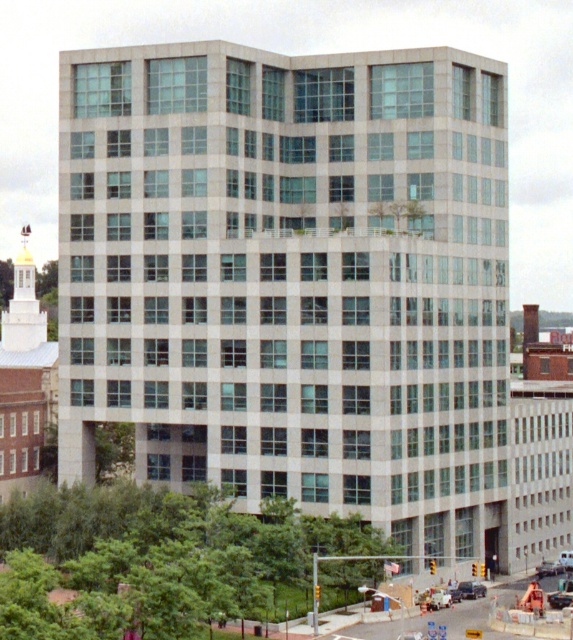
Is point (563, 552) in front of point (453, 588)?

No, it is not.

Identify the location of metallic silver car at lower right. Image resolution: width=573 pixels, height=640 pixels. tap(566, 557).

Which is more to the left, metallic silver sedan at lower right or metallic silver car at lower right?

From the viewer's perspective, metallic silver sedan at lower right appears more on the left side.

Does metallic silver sedan at lower right have a greater width compared to metallic silver car at lower right?

Yes.

Which is behind, point (560, 564) or point (563, 556)?

Point (563, 556)

Identify the location of metallic silver sedan at lower right. (548, 568).

Does metallic silver sedan at center appear on the right side of white matte car at center?

Yes, metallic silver sedan at center is to the right of white matte car at center.

The width and height of the screenshot is (573, 640). I want to click on metallic silver sedan at center, so click(x=472, y=589).

Which is behind, point (461, 593) or point (449, 586)?

Positioned behind is point (449, 586).

Where is `metallic silver sedan at center`? This screenshot has width=573, height=640. metallic silver sedan at center is located at coordinates (472, 589).